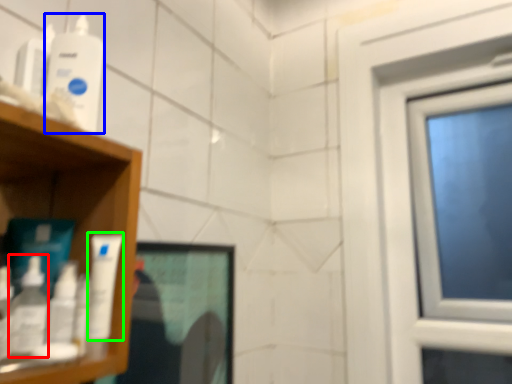
Question: Considering the real-world distances, which object is farthest from mouthwash (highlighted by a red box)? mouthwash (highlighted by a blue box) or mouthwash (highlighted by a green box)?

Choices:
 (A) mouthwash
 (B) mouthwash

Answer: (A)